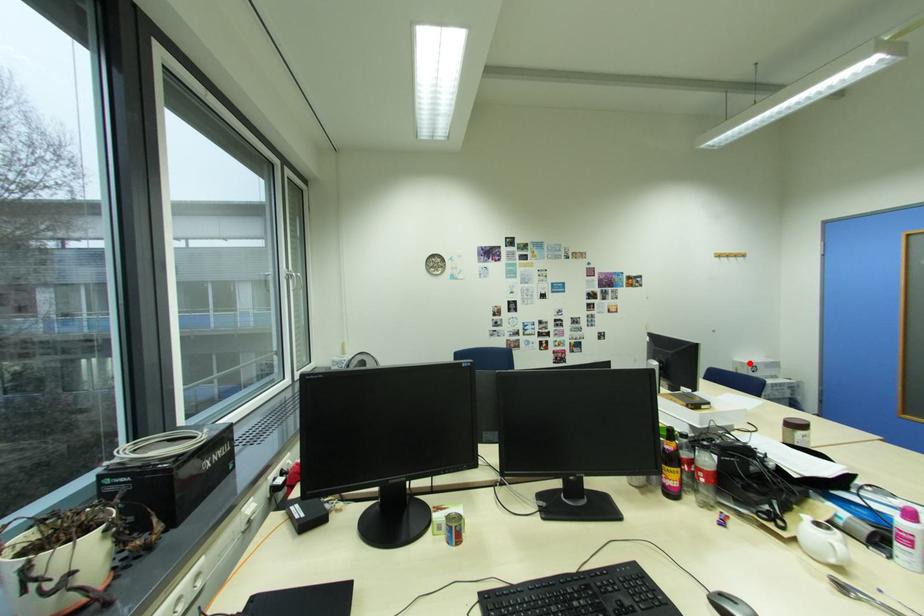
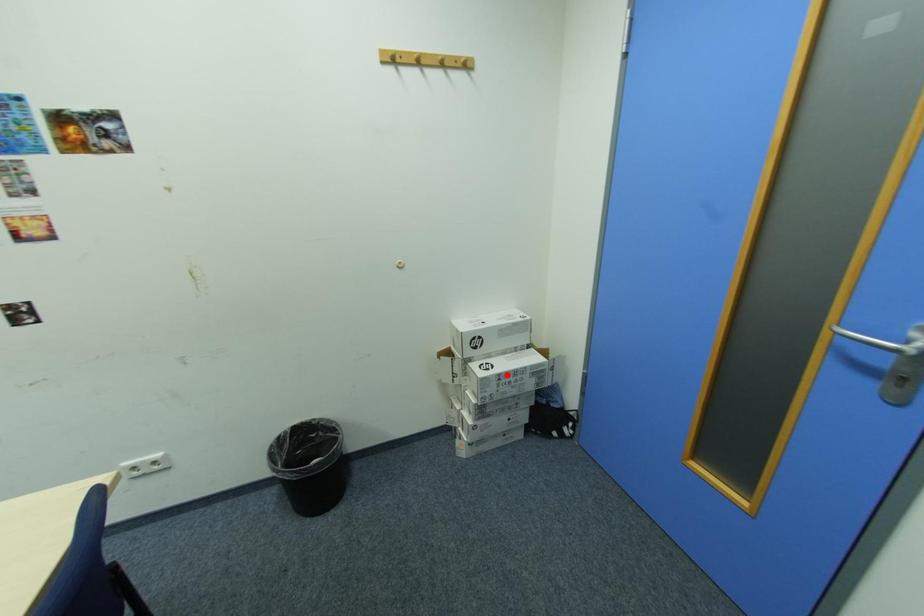
I am providing you with two images of the same scene from different viewpoints. A red point is marked on the first image and another point is marked on the second image. Does the point marked in image1 correspond to the same location as the one in image2?

No